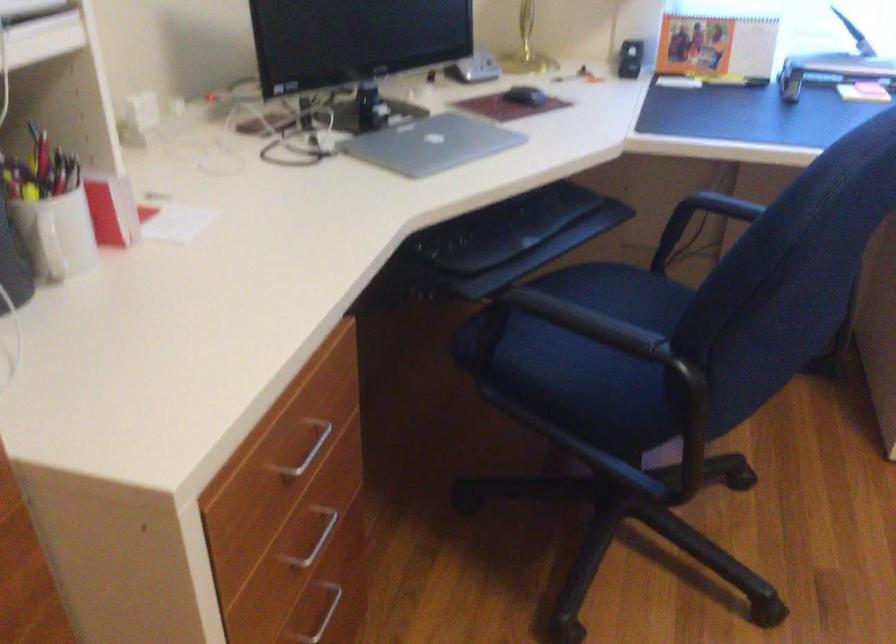
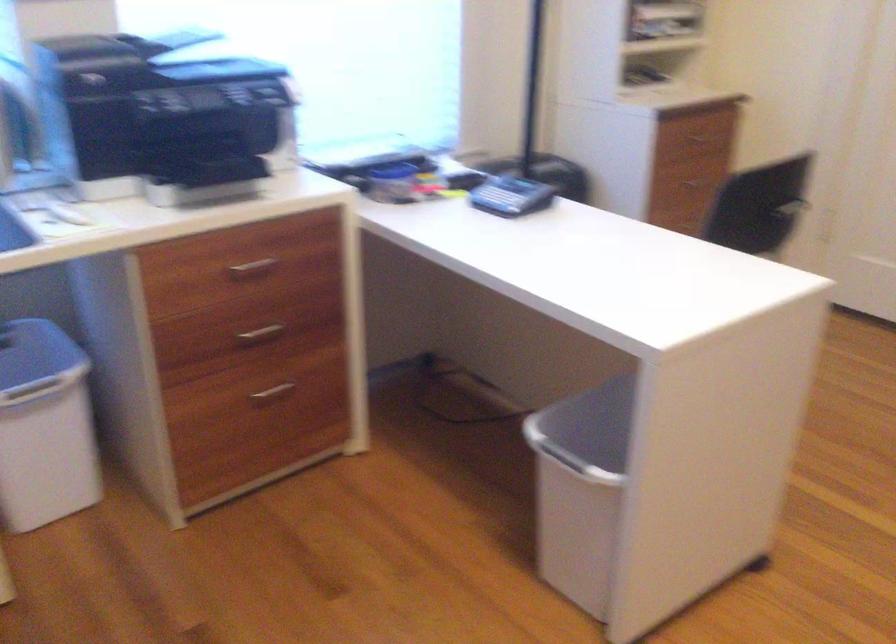
Question: The camera is either moving clockwise (left) or counter-clockwise (right) around the object. The first image is from the beginning of the video and the second image is from the end. Is the camera moving left or right when shooting the video?

Choices:
 (A) Left
 (B) Right

Answer: (A)